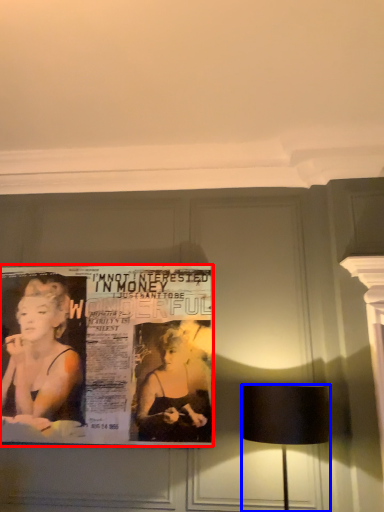
Question: Which object appears farthest to the camera in this image, poster (highlighted by a red box) or lamp (highlighted by a blue box)?

Choices:
 (A) poster
 (B) lamp

Answer: (A)